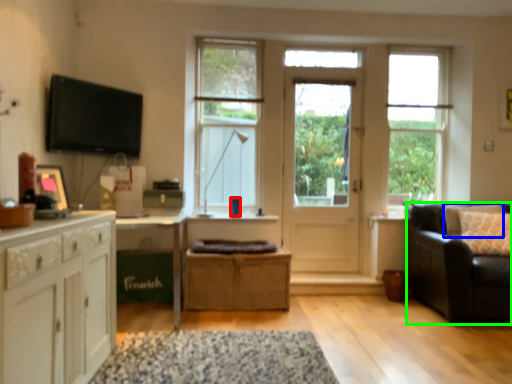
Question: Which is nearer to the coffee cup (highlighted by a red box)? pillow (highlighted by a blue box) or studio couch (highlighted by a green box).

Choices:
 (A) pillow
 (B) studio couch

Answer: (B)